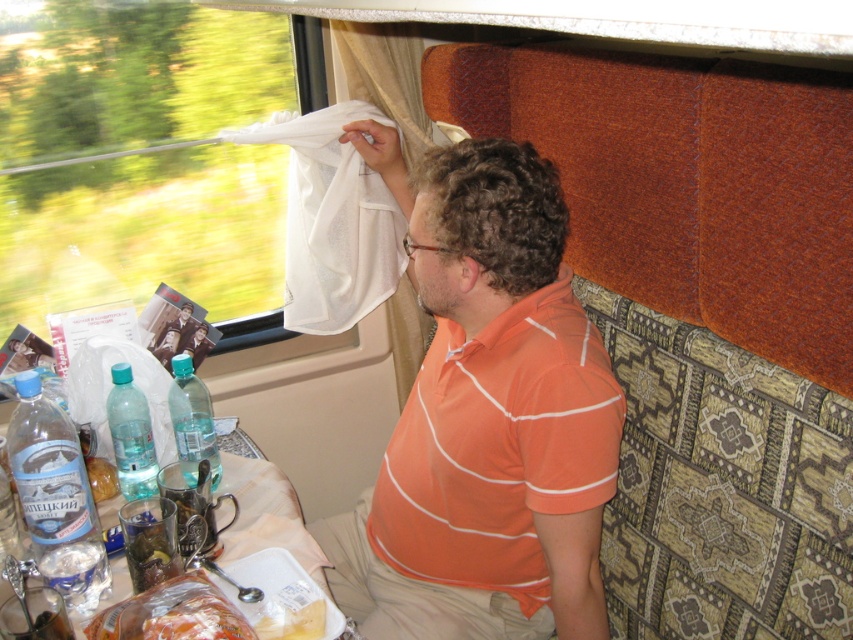
You are a passenger in the train compartment and want to know the exact location of the orange striped shirt at upper right. What are its coordinates?

The orange striped shirt at upper right is located at coordinates point (488, 424).

You are a passenger on the train and need to reach the transparent plastic bottle at table left to get a drink. There is a translucent plastic bag at lower left in the way. Can you move the bag to the side to access the bottle?

The translucent plastic bag at lower left is to the right of the transparent plastic bottle at table left, so moving it to the left would allow access to the bottle.